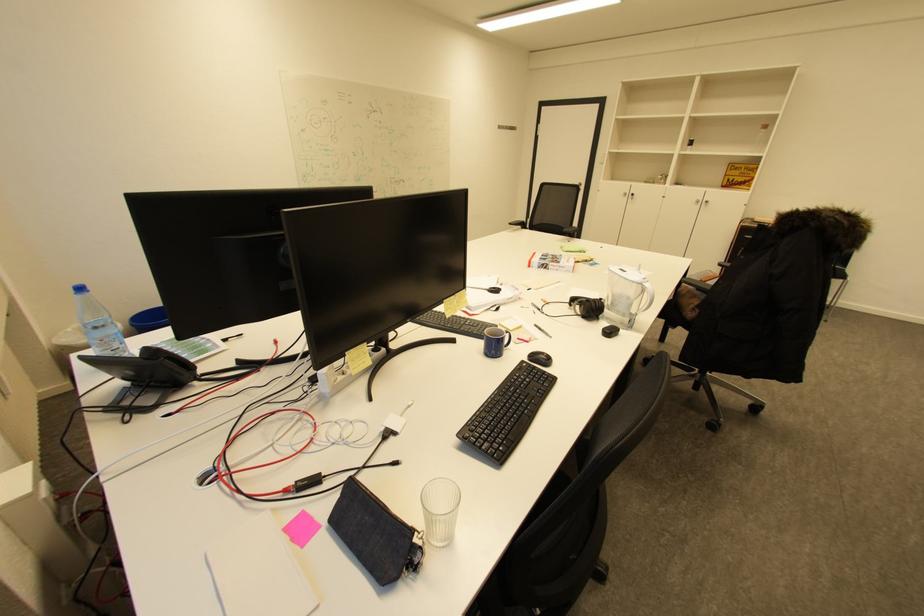
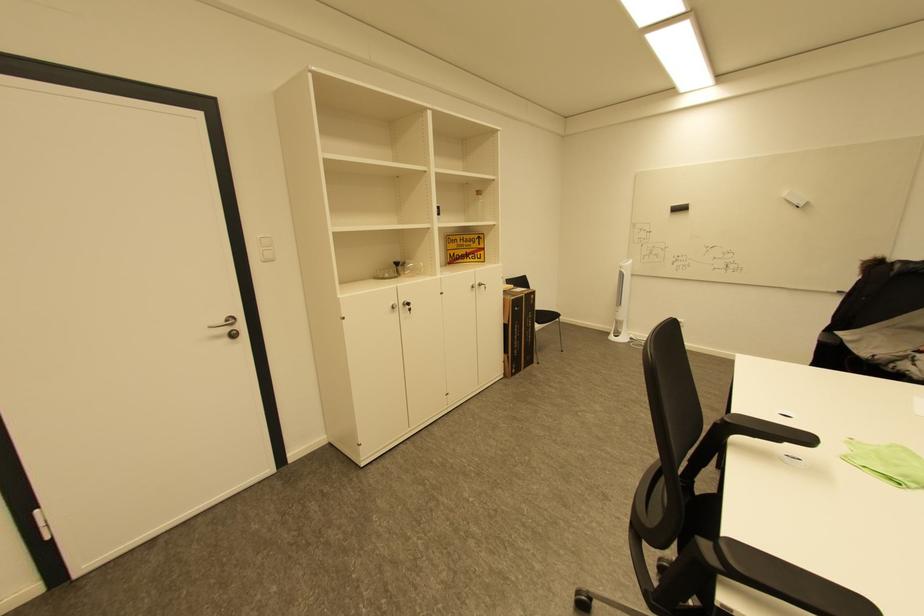
Where in the second image is the point corresponding to point 703,201 from the first image?

(479, 286)